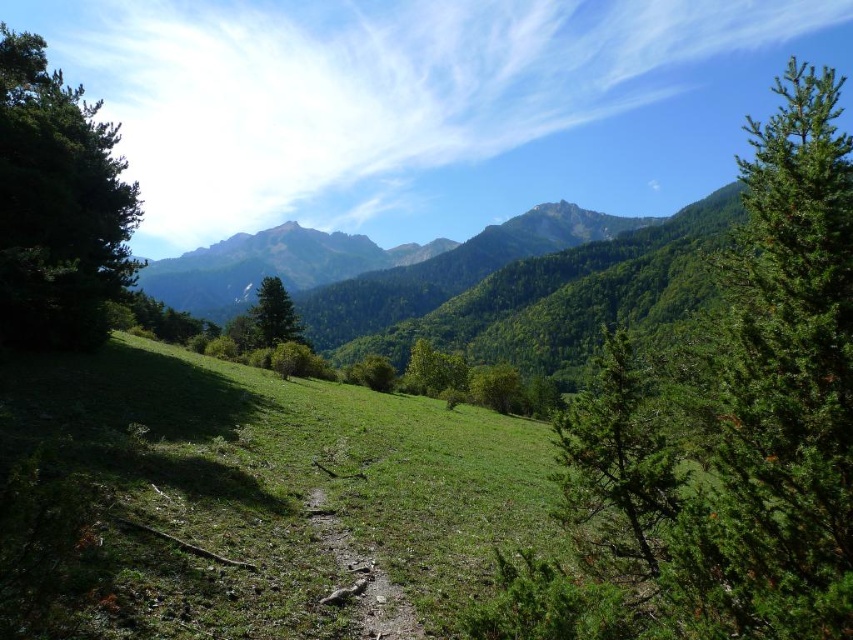
Which is behind, point (125, 192) or point (639, 426)?

The point (125, 192) is more distant.

Does green matte tree at left appear on the right side of green needle-like tree at center-right?

In fact, green matte tree at left is to the left of green needle-like tree at center-right.

The image size is (853, 640). Identify the location of green matte tree at left. pos(57,205).

Image resolution: width=853 pixels, height=640 pixels. I want to click on green matte tree at left, so click(57, 205).

Can you confirm if green textured tree at right is positioned to the right of green forested mountain at center?

Correct, you'll find green textured tree at right to the right of green forested mountain at center.

Between point (779, 449) and point (463, 273), which one is positioned behind?

The point (463, 273) is more distant.

At what (x,y) coordinates should I click in order to perform the action: click on green textured tree at right. Please return your answer as a coordinate pair (x, y). This screenshot has width=853, height=640. Looking at the image, I should click on (721, 432).

Which is more to the left, green matte tree at left or green forested mountain at center?

green forested mountain at center is more to the left.

Between green matte tree at left and green forested mountain at center, which one is positioned lower?

Positioned lower is green matte tree at left.

Is point (85, 333) positioned behind point (415, 250)?

No.

Identify the location of green matte tree at left. This screenshot has width=853, height=640. (57, 205).